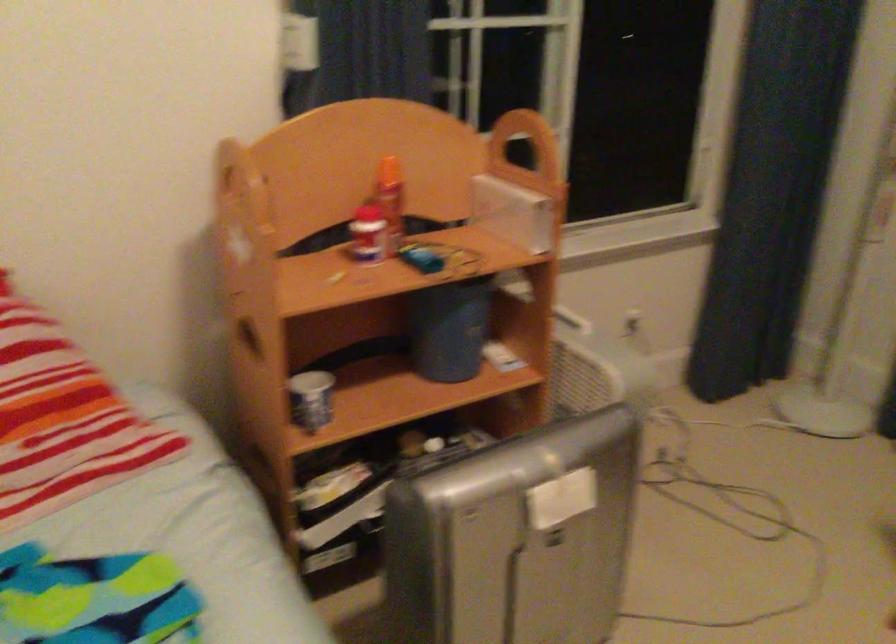
Where would you pull the shelf unit handle? Please return your answer as a coordinate pair (x, y).

(512, 128)